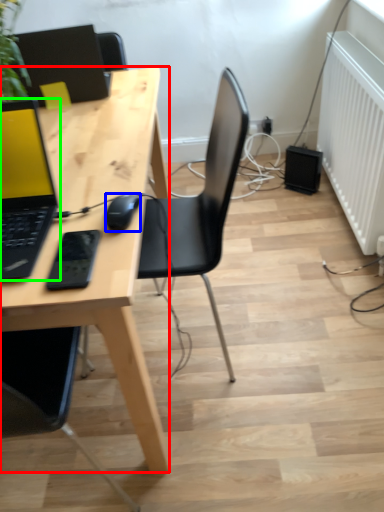
Question: Which object is positioned farthest from desk (highlighted by a red box)? Select from mouse (highlighted by a blue box) and laptop (highlighted by a green box).

Choices:
 (A) mouse
 (B) laptop

Answer: (A)